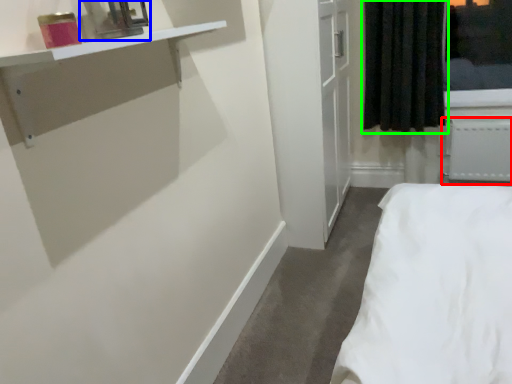
Question: Which is nearer to the radiator (highlighted by a red box)? medicine cabinet (highlighted by a blue box) or curtain (highlighted by a green box).

Choices:
 (A) medicine cabinet
 (B) curtain

Answer: (B)